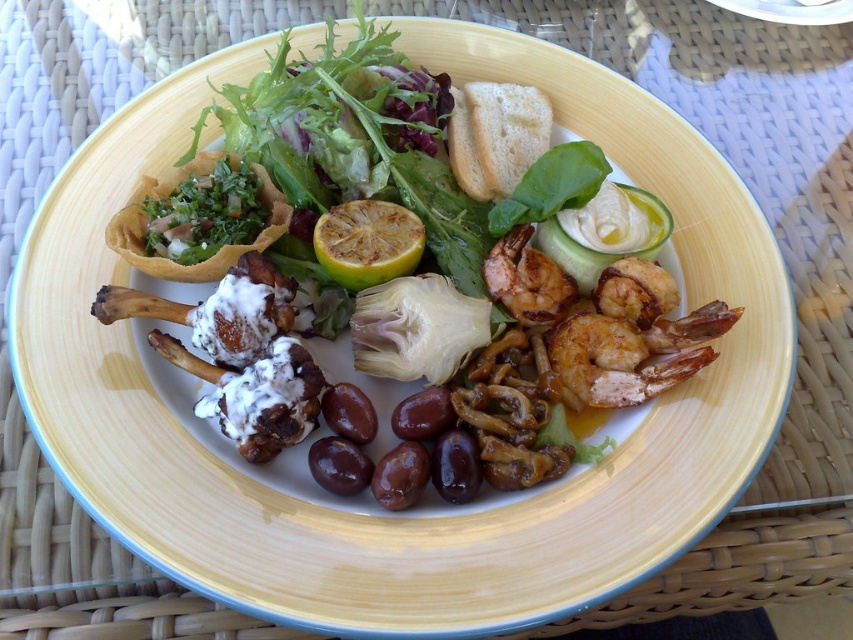
Question: Which point is farther from the camera taking this photo?

Choices:
 (A) (396, 253)
 (B) (517, 276)

Answer: (B)

Question: Which point is farther to the camera?

Choices:
 (A) (529, 317)
 (B) (358, 273)

Answer: (A)

Question: Does yellow juicy lemon at center have a smaller size compared to grilled shrimp at center?

Choices:
 (A) yes
 (B) no

Answer: (B)

Question: In this image, where is yellow juicy lemon at center located relative to grilled shrimp at center?

Choices:
 (A) right
 (B) left

Answer: (B)

Question: Can you confirm if yellow juicy lemon at center is positioned below grilled shrimp at center?

Choices:
 (A) no
 (B) yes

Answer: (A)

Question: Which of the following is the closest to the observer?

Choices:
 (A) grilled shrimp at center
 (B) yellow juicy lemon at center

Answer: (B)